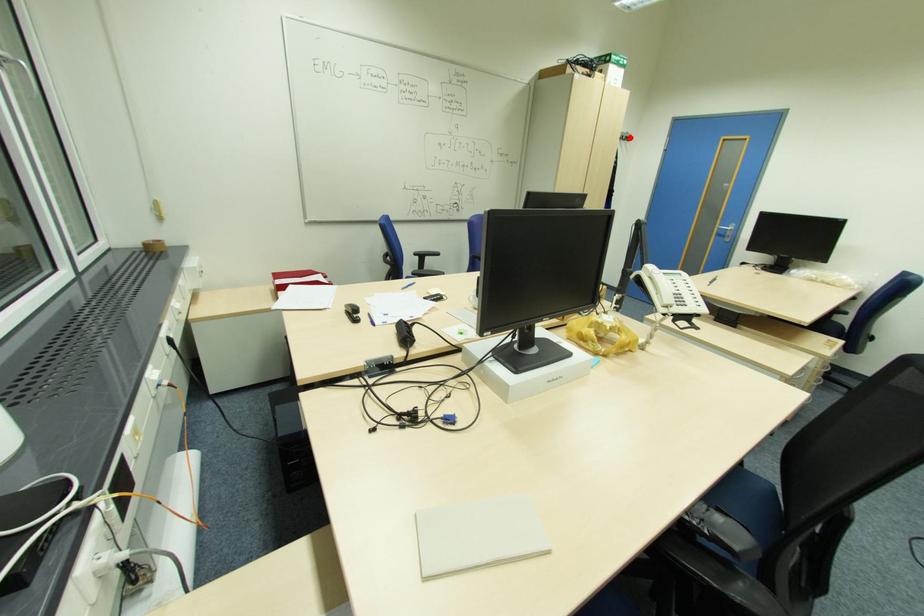
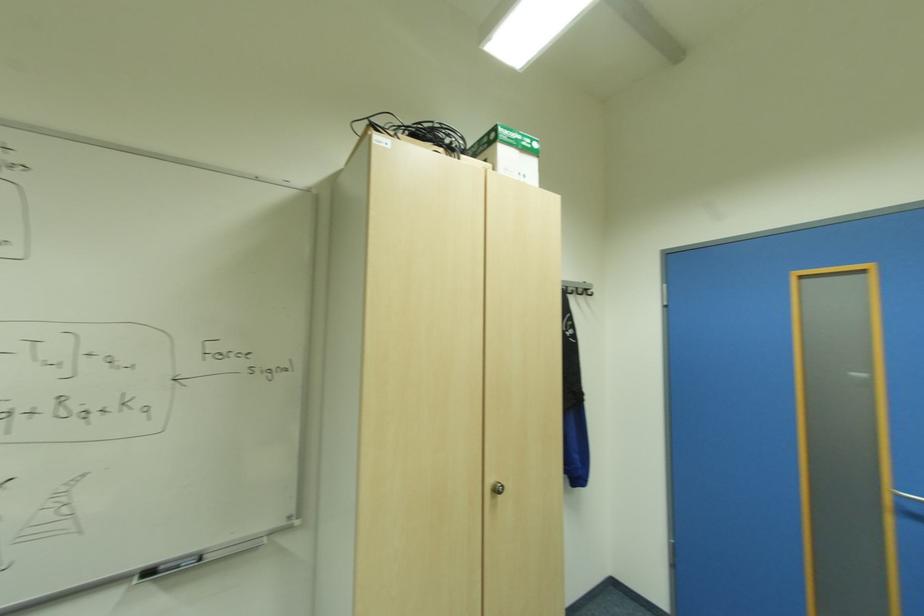
The point at the highlighted location is marked in the first image. Where is the corresponding point in the second image?

(588, 291)